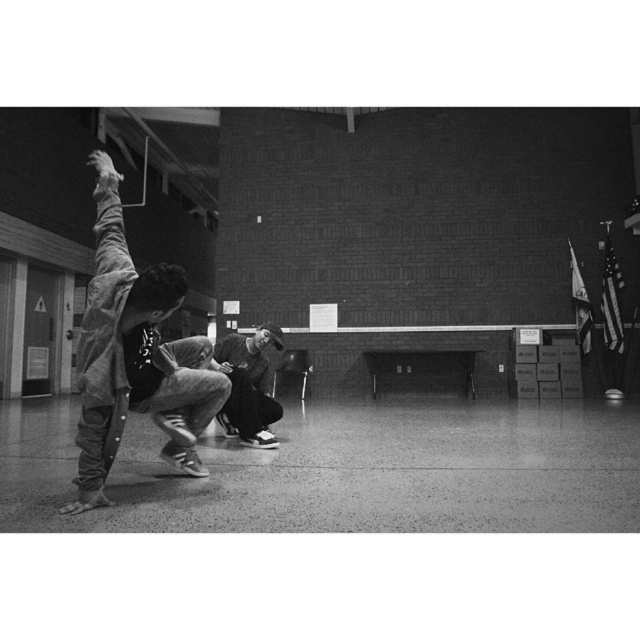
Question: Among these objects, which one is farthest from the camera?

Choices:
 (A) matte black skateboard at left
 (B) dark gray hoodie at center

Answer: (B)

Question: Can you confirm if matte black skateboard at left is bigger than dark gray hoodie at center?

Choices:
 (A) no
 (B) yes

Answer: (B)

Question: Is the position of matte black skateboard at left less distant than that of dark gray hoodie at center?

Choices:
 (A) yes
 (B) no

Answer: (A)

Question: Which point is farther from the camera taking this photo?

Choices:
 (A) (179, 451)
 (B) (252, 372)

Answer: (B)

Question: Which object is farther from the camera taking this photo?

Choices:
 (A) matte black skateboard at left
 (B) dark gray hoodie at center

Answer: (B)

Question: Does matte black skateboard at left have a greater width compared to dark gray hoodie at center?

Choices:
 (A) yes
 (B) no

Answer: (A)